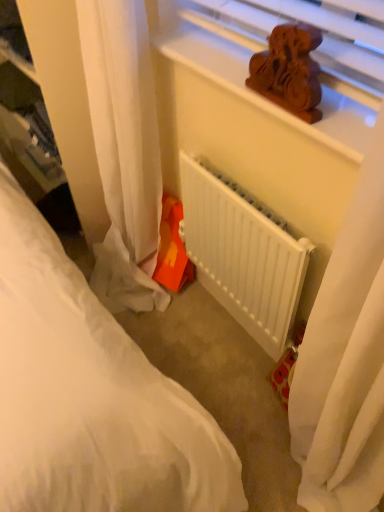
Find the location of a particular element. blank area beneath white matte radiator at center (from a real-world perspective) is located at coordinates (229, 329).